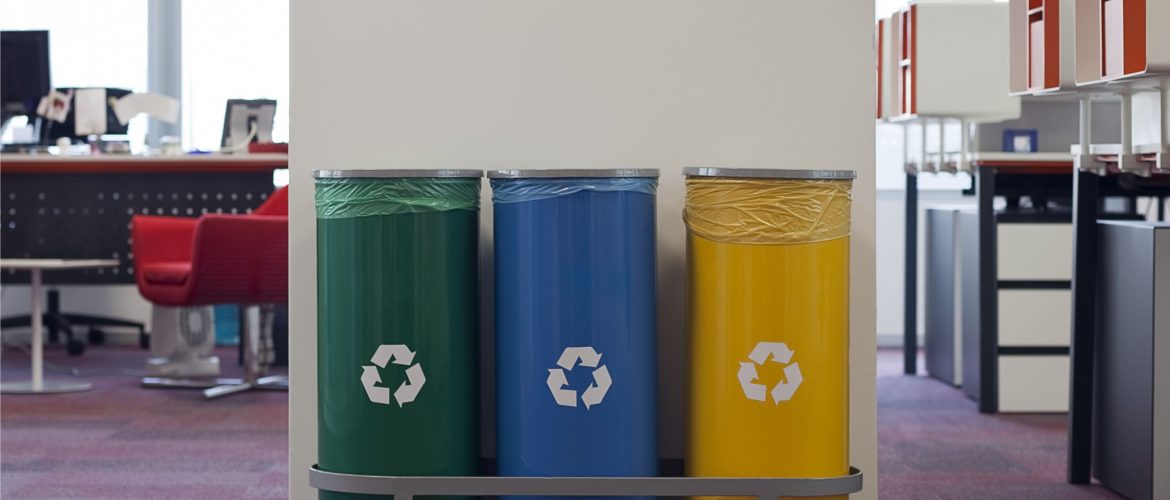
Find the location of a particular element. This screenshot has width=1170, height=500. white drawers is located at coordinates (1041, 248), (1027, 312), (1025, 383).